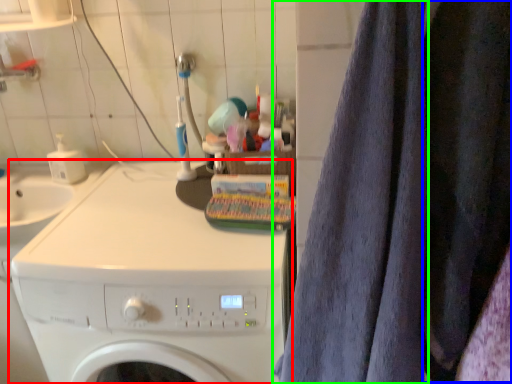
Question: Which object is the closest to the washing machine (highlighted by a red box)? Choose among these: clothing (highlighted by a blue box) or bath towel (highlighted by a green box).

Choices:
 (A) clothing
 (B) bath towel

Answer: (B)